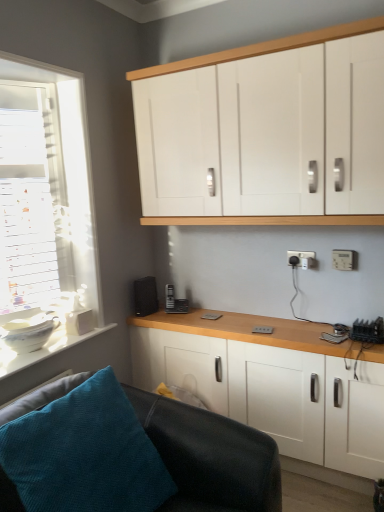
What do you see at coordinates (261, 48) in the screenshot? The width and height of the screenshot is (384, 512). I see `white matte cabinet at upper center, marked as the 1th cabinetry in a top-to-bottom arrangement` at bounding box center [261, 48].

What is the approximate height of white plastic electric outlet at lower right, the second electric outlet from the left?

It is 11.31 centimeters.

What is the approximate width of white plastic socket at upper right, acting as the 1th electric outlet starting from the left?

The width of white plastic socket at upper right, acting as the 1th electric outlet starting from the left, is 0.53 inches.

In order to face white plastic socket at upper right, which is counted as the 2th electric outlet, starting from the front, should I rotate leftwards or rightwards?

It's best to rotate right around 14.728 degrees.

What is the approximate height of black matte speaker at lower left?

black matte speaker at lower left is 9.87 inches tall.

What is the approximate width of white glossy bowl at lower left?

14.47 inches.

At what (x,y) coordinates should I click in order to perform the action: click on white matte cabinet at upper center, arranged as the 2th cabinetry when ordered from the bottom. Please return your answer as a coordinate pair (x, y). This screenshot has height=512, width=384. Looking at the image, I should click on pos(261,48).

Can you confirm if white matte cabinet at upper center, arranged as the 2th cabinetry when ordered from the bottom, is wider than black leather couch at lower left?

Incorrect, the width of white matte cabinet at upper center, arranged as the 2th cabinetry when ordered from the bottom, does not surpass that of black leather couch at lower left.

Measure the distance from white matte cabinet at upper center, arranged as the 2th cabinetry when ordered from the bottom, to black leather couch at lower left.

The distance of white matte cabinet at upper center, arranged as the 2th cabinetry when ordered from the bottom, from black leather couch at lower left is 5.46 feet.

There is a black leather couch at lower left. Where is `cabinetry above it (from a real-world perspective)`? cabinetry above it (from a real-world perspective) is located at coordinates (261, 48).

Which of these two, white matte cabinet at upper center, marked as the 1th cabinetry in a top-to-bottom arrangement, or black leather couch at lower left, is smaller?

Smaller between the two is white matte cabinet at upper center, marked as the 1th cabinetry in a top-to-bottom arrangement.

Locate an element on the screen. Image resolution: width=384 pixels, height=512 pixels. studio couch in front of the white matte cabinet at upper center, arranged as the 2th cabinetry when ordered from the bottom is located at coordinates (210, 457).

From the image's perspective, which is above, black leather couch at lower left or white matte cabinet at upper center, marked as the 1th cabinetry in a top-to-bottom arrangement?

white matte cabinet at upper center, marked as the 1th cabinetry in a top-to-bottom arrangement.

Between black leather couch at lower left and white matte cabinet at upper center, arranged as the 2th cabinetry when ordered from the bottom, which one has smaller width?

white matte cabinet at upper center, arranged as the 2th cabinetry when ordered from the bottom, is thinner.

Which is in front, point (197, 476) or point (175, 67)?

Positioned in front is point (197, 476).

Is the position of white matte cabinet at lower center, acting as the first cabinetry starting from the bottom, more distant than that of white glossy bowl at lower left?

Yes, white matte cabinet at lower center, acting as the first cabinetry starting from the bottom, is further from the camera.

Is white matte cabinet at lower center, the 2th cabinetry viewed from the top, aimed at white glossy bowl at lower left?

Yes, white matte cabinet at lower center, the 2th cabinetry viewed from the top, is oriented towards white glossy bowl at lower left.

Would you say white glossy bowl at lower left is part of white matte cabinet at lower center, acting as the first cabinetry starting from the bottom,'s contents?

That's incorrect, white glossy bowl at lower left is not inside white matte cabinet at lower center, acting as the first cabinetry starting from the bottom.

Is white plastic electric outlet at lower right, the second electric outlet when ordered from back to front, next to black matte speaker at lower left?

No, white plastic electric outlet at lower right, the second electric outlet when ordered from back to front, is not in contact with black matte speaker at lower left.

Does white plastic electric outlet at lower right, marked as the first electric outlet in a front-to-back arrangement, appear on the right side of black matte speaker at lower left?

Indeed, white plastic electric outlet at lower right, marked as the first electric outlet in a front-to-back arrangement, is positioned on the right side of black matte speaker at lower left.

Which is in front, point (336, 250) or point (136, 303)?

The point (336, 250) is more forward.

Locate an element on the screen. The image size is (384, 512). the 1st electric outlet above when counting from the black matte speaker at lower left (from the image's perspective) is located at coordinates (344, 259).

Based on the photo, from a real-world perspective, is black leather couch at lower left on top of white matte cabinet at lower center, the 2th cabinetry viewed from the top?

Correct, in the physical world, black leather couch at lower left is higher than white matte cabinet at lower center, the 2th cabinetry viewed from the top.

Is black leather couch at lower left far from white matte cabinet at lower center, acting as the first cabinetry starting from the bottom?

No, there isn't a large distance between black leather couch at lower left and white matte cabinet at lower center, acting as the first cabinetry starting from the bottom.

Is black leather couch at lower left to the right of white matte cabinet at lower center, the 2th cabinetry viewed from the top, from the viewer's perspective?

In fact, black leather couch at lower left is to the left of white matte cabinet at lower center, the 2th cabinetry viewed from the top.

Considering the positions of points (244, 469) and (218, 387), is point (244, 469) farther from camera compared to point (218, 387)?

That is False.

Would you say black matte speaker at lower left contains white matte cabinet at upper center, arranged as the 2th cabinetry when ordered from the bottom?

No, white matte cabinet at upper center, arranged as the 2th cabinetry when ordered from the bottom, is not surrounded by black matte speaker at lower left.

From a real-world perspective, is black matte speaker at lower left positioned under white matte cabinet at upper center, marked as the 1th cabinetry in a top-to-bottom arrangement, based on gravity?

Yes.

Between black matte speaker at lower left and white matte cabinet at upper center, marked as the 1th cabinetry in a top-to-bottom arrangement, which one has less height?

black matte speaker at lower left.

Between white plastic socket at upper right, which is counted as the 2th electric outlet, starting from the front, and white matte cabinet at lower center, acting as the first cabinetry starting from the bottom, which one is positioned behind?

white plastic socket at upper right, which is counted as the 2th electric outlet, starting from the front, is further away from the camera.

From the image's perspective, which electric outlet is the 2nd one above the white matte cabinet at lower center, the 2th cabinetry viewed from the top? Please provide its 2D coordinates.

[(301, 259)]

From the image's perspective, is white plastic socket at upper right, placed as the 2th electric outlet when sorted from right to left, above white matte cabinet at lower center, the 2th cabinetry viewed from the top?

Yes, from the image's perspective, white plastic socket at upper right, placed as the 2th electric outlet when sorted from right to left, is above white matte cabinet at lower center, the 2th cabinetry viewed from the top.

In terms of width, does white plastic socket at upper right, which appears as the first electric outlet when viewed from the back, look wider or thinner when compared to white matte cabinet at lower center, the 2th cabinetry viewed from the top?

In the image, white plastic socket at upper right, which appears as the first electric outlet when viewed from the back, appears to be more narrow than white matte cabinet at lower center, the 2th cabinetry viewed from the top.

From the black leather couch at lower left, count 1st cabinetrys backward and point to it. Please provide its 2D coordinates.

[(261, 48)]

Locate an element on the screen. studio couch on the left of white matte cabinet at upper center, marked as the 1th cabinetry in a top-to-bottom arrangement is located at coordinates (210, 457).

Which object lies further to the anchor point white plastic electric outlet at lower right, the second electric outlet when ordered from back to front, white matte cabinet at upper center, arranged as the 2th cabinetry when ordered from the bottom, or black matte speaker at lower left?

black matte speaker at lower left lies further to white plastic electric outlet at lower right, the second electric outlet when ordered from back to front, than the other object.

Looking at the image, which one is located further to white glossy bowl at lower left, white plastic electric outlet at lower right, the second electric outlet from the left, or white plastic socket at upper right, acting as the 1th electric outlet starting from the left?

Based on the image, white plastic electric outlet at lower right, the second electric outlet from the left, appears to be further to white glossy bowl at lower left.

Considering their positions, is white plastic electric outlet at lower right, the second electric outlet from the left, positioned further to white matte cabinet at lower center, acting as the first cabinetry starting from the bottom, than white glossy bowl at lower left?

white glossy bowl at lower left is further to white matte cabinet at lower center, acting as the first cabinetry starting from the bottom.

Considering their positions, is black leather couch at lower left positioned further to white matte cabinet at upper center, marked as the 1th cabinetry in a top-to-bottom arrangement, than white glossy bowl at lower left?

black leather couch at lower left is further to white matte cabinet at upper center, marked as the 1th cabinetry in a top-to-bottom arrangement.

Considering their positions, is white glossy bowl at lower left positioned further to white plastic socket at upper right, which appears as the first electric outlet when viewed from the back, than black matte speaker at lower left?

white glossy bowl at lower left.

From the picture: Which object lies nearer to the anchor point white matte cabinet at lower center, the 2th cabinetry viewed from the top, black matte speaker at lower left or white plastic electric outlet at lower right, the 1th electric outlet when ordered from right to left?

black matte speaker at lower left lies closer to white matte cabinet at lower center, the 2th cabinetry viewed from the top, than the other object.

Looking at the image, which one is located further to white matte cabinet at lower center, acting as the first cabinetry starting from the bottom, white plastic socket at upper right, placed as the 2th electric outlet when sorted from right to left, or black leather couch at lower left?

white plastic socket at upper right, placed as the 2th electric outlet when sorted from right to left.

Which object lies further to the anchor point white plastic electric outlet at lower right, the second electric outlet when ordered from back to front, white glossy bowl at lower left or white matte cabinet at lower center, acting as the first cabinetry starting from the bottom?

white glossy bowl at lower left is positioned further to the anchor white plastic electric outlet at lower right, the second electric outlet when ordered from back to front.

Image resolution: width=384 pixels, height=512 pixels. I want to click on speaker between white glossy bowl at lower left and white plastic socket at upper right, which appears as the first electric outlet when viewed from the back, in the horizontal direction, so click(145, 296).

Image resolution: width=384 pixels, height=512 pixels. What are the coordinates of `electric outlet between white plastic socket at upper right, acting as the 1th electric outlet starting from the left, and white matte cabinet at lower center, the 2th cabinetry viewed from the top, in the up-down direction` in the screenshot? It's located at (344, 259).

At what (x,y) coordinates should I click in order to perform the action: click on counter top between white matte cabinet at upper center, marked as the 1th cabinetry in a top-to-bottom arrangement, and white matte cabinet at lower center, the 2th cabinetry viewed from the top, in the up-down direction. Please return your answer as a coordinate pair (x, y). Looking at the image, I should click on point(43,350).

I want to click on studio couch between white matte cabinet at upper center, marked as the 1th cabinetry in a top-to-bottom arrangement, and white matte cabinet at lower center, the 2th cabinetry viewed from the top, from top to bottom, so click(x=210, y=457).